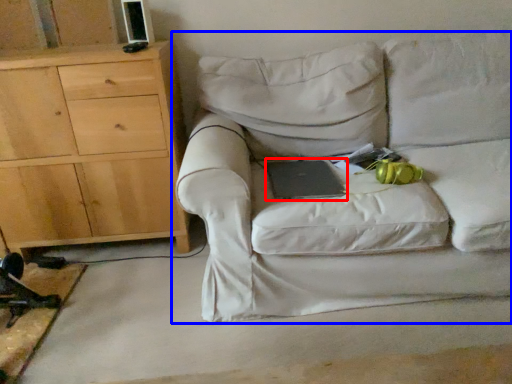
Question: Among these objects, which one is nearest to the camera, paperback book (highlighted by a red box) or studio couch (highlighted by a blue box)?

Choices:
 (A) paperback book
 (B) studio couch

Answer: (B)